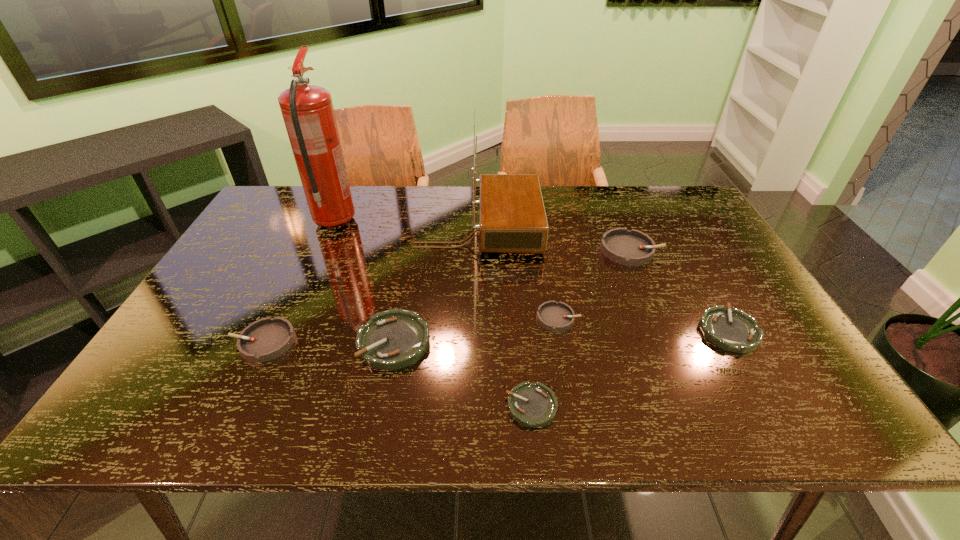
You are a GUI agent. You are given a task and a screenshot of the screen. Output one action in this format:
    pyautogui.click(x=<x>, y=<y>)
    Task: Click on the rightmost green ashtray
    
    Given the screenshot: What is the action you would take?
    [733, 330]

Where is `the shortest object`? This screenshot has height=540, width=960. the shortest object is located at coordinates (534, 405).

This screenshot has width=960, height=540. Find the location of `the shortest ashtray`. the shortest ashtray is located at coordinates (534, 405).

At what (x,y) coordinates should I click in order to perform the action: click on free space located on the handle side the fire extinguisher. Please return your answer as a coordinate pair (x, y). This screenshot has height=540, width=960. Looking at the image, I should click on 350,187.

In order to click on free location located on the handle side the fire extinguisher in this screenshot , I will do `click(348, 194)`.

You are a GUI agent. You are given a task and a screenshot of the screen. Output one action in this format:
    pyautogui.click(x=<x>, y=<y>)
    Task: Click on the vacant area situated 0.090m on the handle side the fire extinguisher
    
    Given the screenshot: What is the action you would take?
    pyautogui.click(x=348, y=192)

You are a GUI agent. You are given a task and a screenshot of the screen. Output one action in this format:
    pyautogui.click(x=<x>, y=<y>)
    Task: Click on the vacant area situated on the front panel of the second tallest object
    The image size is (960, 540).
    Given the screenshot: What is the action you would take?
    pyautogui.click(x=611, y=229)

Where is `free point located 0.120m on the front of the tallest ashtray`? This screenshot has height=540, width=960. free point located 0.120m on the front of the tallest ashtray is located at coordinates (650, 295).

At what (x,y) coordinates should I click in order to perform the action: click on free location located on the right of the second biggest gray ashtray. Please return your answer as a coordinate pair (x, y). Image resolution: width=960 pixels, height=540 pixels. Looking at the image, I should click on (409, 341).

You are a GUI agent. You are given a task and a screenshot of the screen. Output one action in this format:
    pyautogui.click(x=<x>, y=<y>)
    Task: Click on the vacant space situated 0.330m on the back of the biggest green ashtray
    The image size is (960, 540).
    Given the screenshot: What is the action you would take?
    pyautogui.click(x=414, y=238)